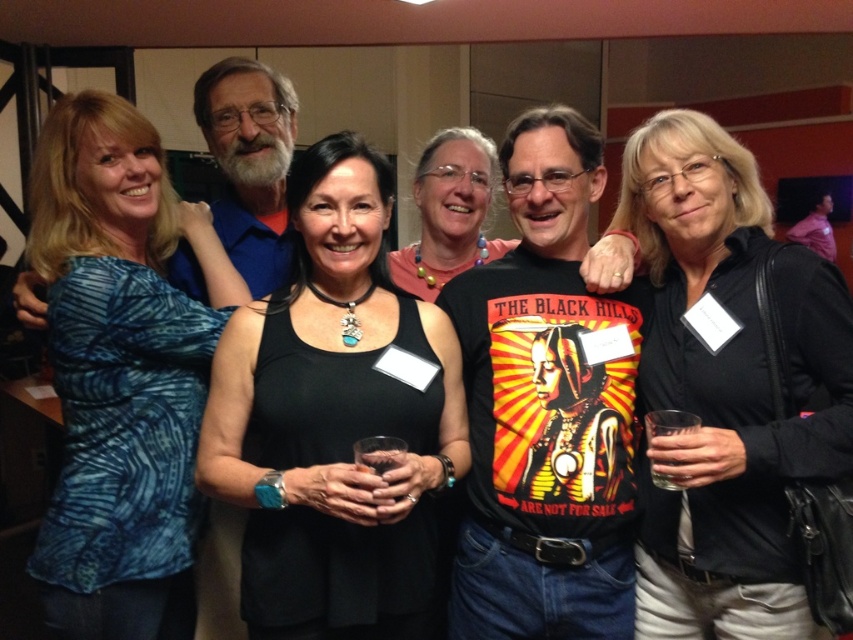
You are a photographer trying to capture a clear shot of both the black matte jacket at center and the matte black tank top at center. Since you want both items to be in focus, which one should you adjust your camera focus to prioritize first?

The black matte jacket at center is closer to the viewer than the matte black tank top at center, so you should focus on the black matte jacket at center first to ensure both are in focus.

You are standing in the room and want to reach the point marked at coordinates (717, 397). If you take a step forward of 1 meter, how far will you still need to move to reach that point?

The point marked at coordinates (717, 397) is 1.37 meters away from the viewer. After taking a 1 meter step forward, you will still need to move 0.37 meters to reach it.